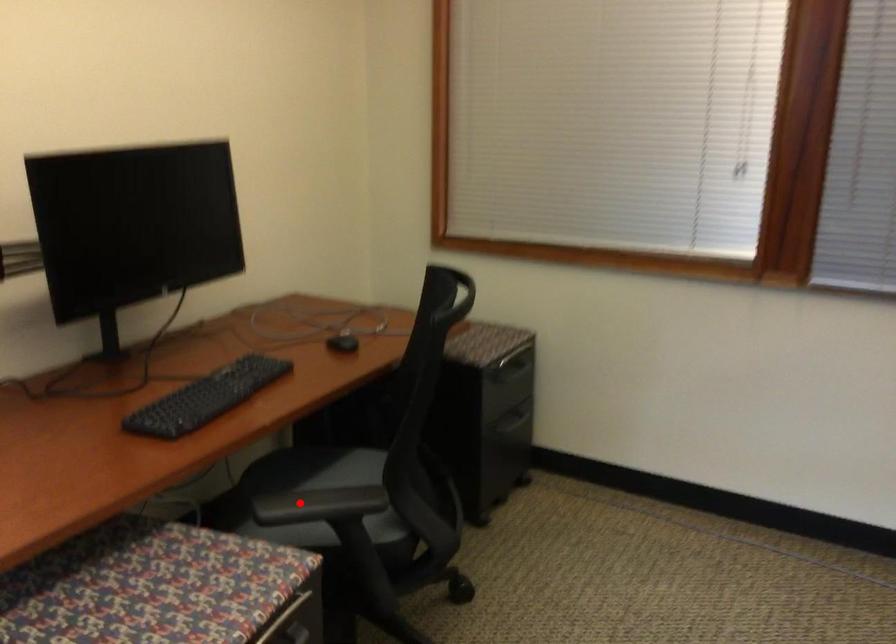
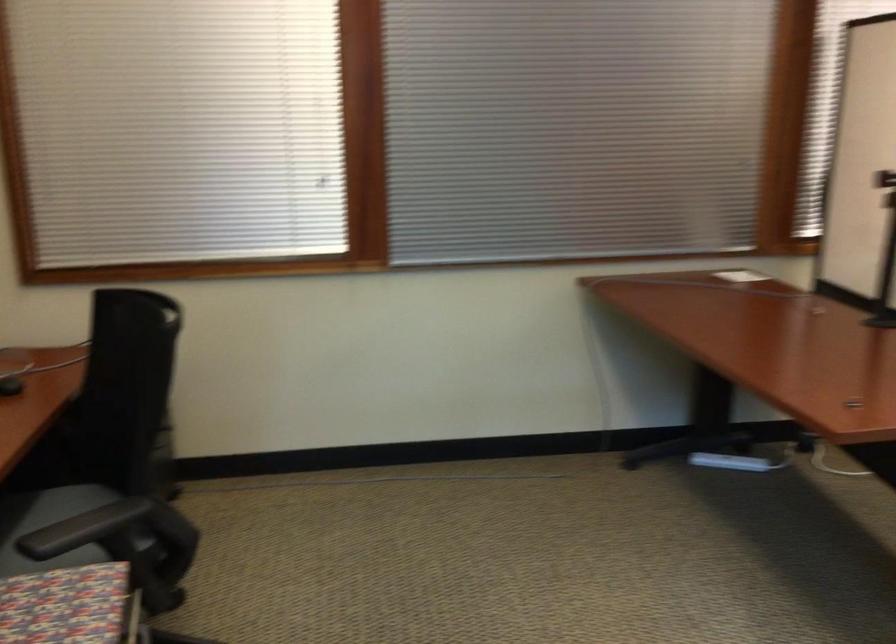
Where in the second image is the point corresponding to the highlighted location from the first image?

(83, 529)